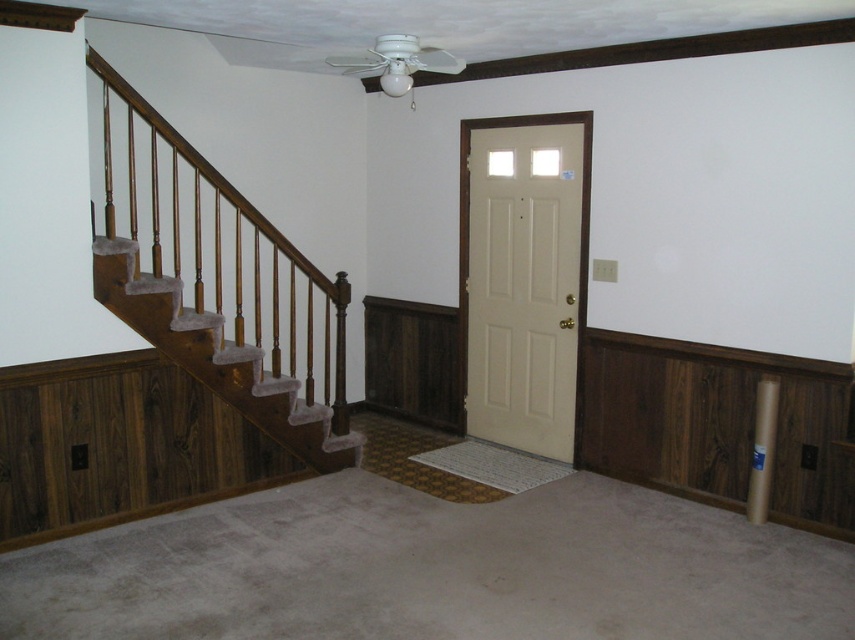
You are a delivery person trying to enter the beige matte door at center. You notice a wooden stair railing at left in your way. Can you walk through the space between them?

The wooden stair railing at left is positioned over beige matte door at center, meaning they are vertically aligned. Since the railing is above the door, you can walk through the space between them as they are not blocking the path horizontally.